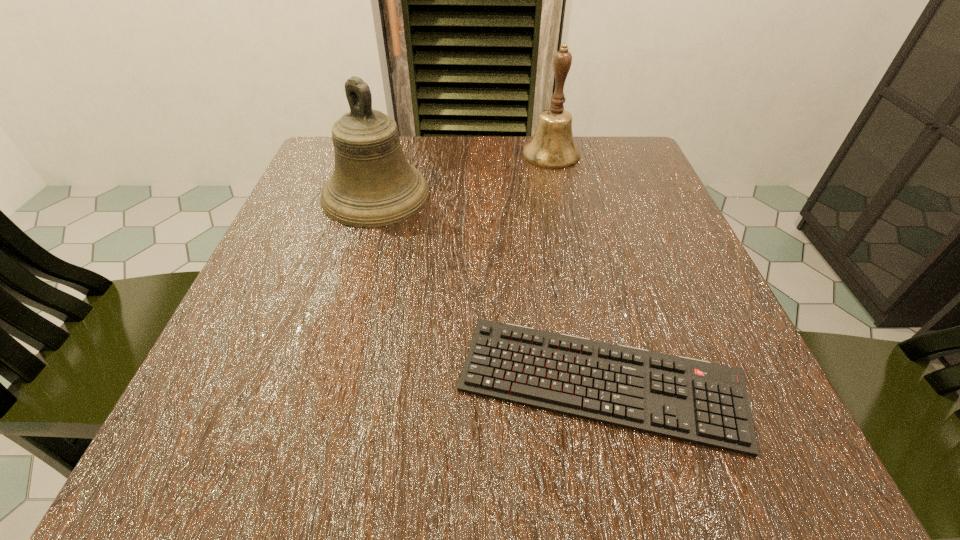
In order to click on the right bell in this screenshot , I will do `click(552, 146)`.

Where is `the leftmost object`? the leftmost object is located at coordinates (373, 185).

The image size is (960, 540). I want to click on the shortest object, so click(x=691, y=400).

I want to click on computer keyboard, so click(x=691, y=400).

Find the location of a particular element. free space located 0.140m on the front of the right bell is located at coordinates (564, 208).

I want to click on vacant space located 0.070m on the back of the left bell, so click(389, 150).

Identify the location of free location located 0.140m on the back of the computer keyboard. (573, 259).

This screenshot has height=540, width=960. I want to click on object located at the near edge, so click(x=691, y=400).

You are a GUI agent. You are given a task and a screenshot of the screen. Output one action in this format:
    pyautogui.click(x=<x>, y=<y>)
    Task: Click on the object that is at the left edge
    
    Given the screenshot: What is the action you would take?
    pyautogui.click(x=373, y=185)

At what (x,y) coordinates should I click in order to perform the action: click on bell that is at the right edge. Please return your answer as a coordinate pair (x, y). Looking at the image, I should click on (552, 146).